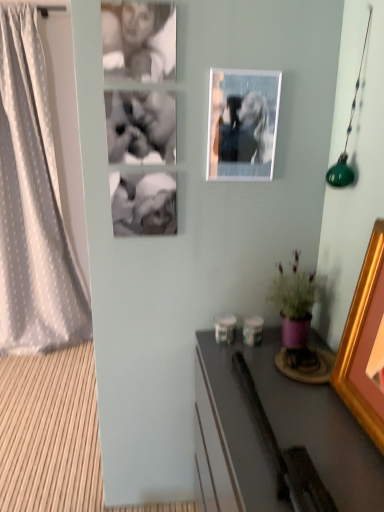
Question: Is white dotted fabric curtain at left bigger or smaller than gold wooden picture frame at right, which is counted as the first picture frame, starting from the front?

Choices:
 (A) small
 (B) big

Answer: (B)

Question: Considering their positions, is white dotted fabric curtain at left located in front of or behind gold wooden picture frame at right, marked as the 1th picture frame in a right-to-left arrangement?

Choices:
 (A) behind
 (B) front

Answer: (A)

Question: Considering the real-world distances, which object is closest to the gold wooden picture frame at right, which is counted as the first picture frame, starting from the front?

Choices:
 (A) metallic silver photo frame at upper center, the first picture frame viewed from the left
 (B) smooth gray desk at lower right
 (C) purple matte pot at lower right
 (D) white dotted fabric curtain at left

Answer: (B)

Question: Which is nearer to the purple matte pot at lower right?

Choices:
 (A) white dotted fabric curtain at left
 (B) gold wooden picture frame at right, marked as the 1th picture frame in a right-to-left arrangement
 (C) smooth gray desk at lower right
 (D) metallic silver photo frame at upper center, the first picture frame viewed from the left

Answer: (C)